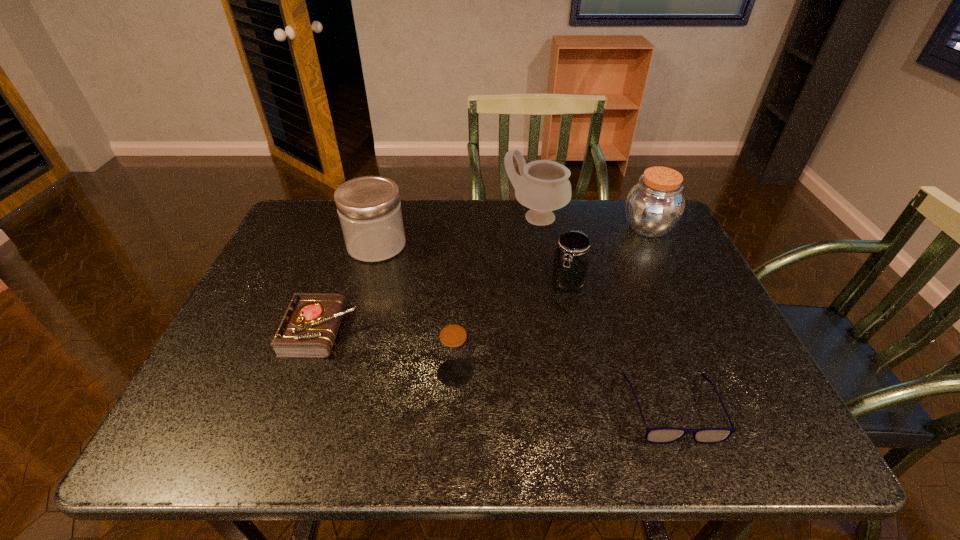
You are a GUI agent. You are given a task and a screenshot of the screen. Output one action in this format:
    pyautogui.click(x=<x>, y=<y>)
    Task: Click on the pottery
    Image resolution: width=960 pixels, height=540 pixels.
    Given the screenshot: What is the action you would take?
    pyautogui.click(x=543, y=186)

At what (x,y) coordinates should I click in order to perform the action: click on the leftmost jar. Please return your answer as a coordinate pair (x, y). Image resolution: width=960 pixels, height=540 pixels. Looking at the image, I should click on (369, 208).

Identify the location of the rightmost jar. (655, 205).

I want to click on the second nearest jar, so click(x=570, y=266).

Where is `the third jar from left to right`? The image size is (960, 540). the third jar from left to right is located at coordinates (570, 266).

The height and width of the screenshot is (540, 960). I want to click on the second jar from left to right, so click(x=453, y=348).

Locate an element on the screen. This screenshot has height=540, width=960. the nearest jar is located at coordinates (453, 348).

Find the location of a particular element. diary is located at coordinates (309, 327).

Find the location of a particular element. The height and width of the screenshot is (540, 960). spectacles is located at coordinates (659, 435).

I want to click on free space located 0.190m on the right of the pottery, so click(x=628, y=218).